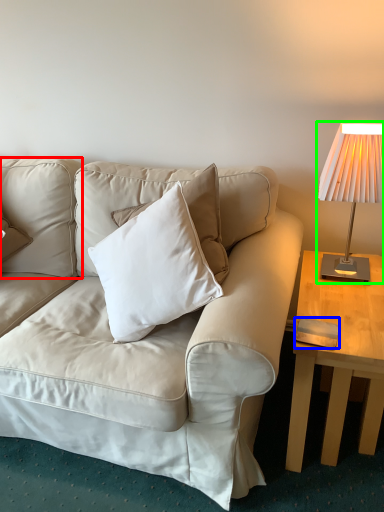
Question: Based on their relative distances, which object is nearer to pillow (highlighted by a red box)? Choose from pad (highlighted by a blue box) and lamp (highlighted by a green box).

Choices:
 (A) pad
 (B) lamp

Answer: (B)